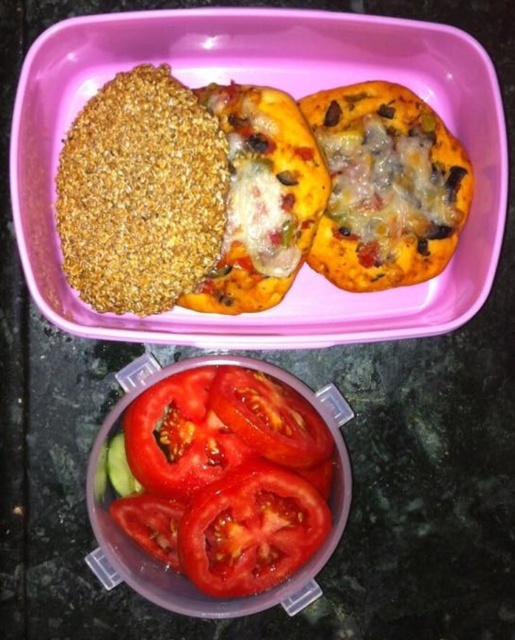
Is red matte tomato at lower center to the right of sliced red tomato at lower center from the viewer's perspective?

Correct, you'll find red matte tomato at lower center to the right of sliced red tomato at lower center.

Does red matte tomato at lower center appear over sliced red tomato at lower center?

No.

Is point (254, 522) positioned before point (163, 532)?

Yes, it is.

You are a GUI agent. You are given a task and a screenshot of the screen. Output one action in this format:
    pyautogui.click(x=<x>, y=<y>)
    Task: Click on the red matte tomato at lower center
    This screenshot has height=640, width=515.
    Given the screenshot: What is the action you would take?
    pyautogui.click(x=250, y=529)

Is red matte tomato at center to the left of sliced red tomato at center from the viewer's perspective?

Correct, you'll find red matte tomato at center to the left of sliced red tomato at center.

Between red matte tomato at center and sliced red tomato at center, which one appears on the left side from the viewer's perspective?

red matte tomato at center is more to the left.

What are the coordinates of `red matte tomato at center` in the screenshot? It's located at (180, 435).

Image resolution: width=515 pixels, height=640 pixels. Describe the element at coordinates (180, 435) in the screenshot. I see `red matte tomato at center` at that location.

Which is behind, point (207, 444) or point (178, 499)?

Positioned behind is point (207, 444).

Is point (150, 388) positioned before point (150, 531)?

No, (150, 388) is further to viewer.

The height and width of the screenshot is (640, 515). Identify the location of red matte tomato at center. (180, 435).